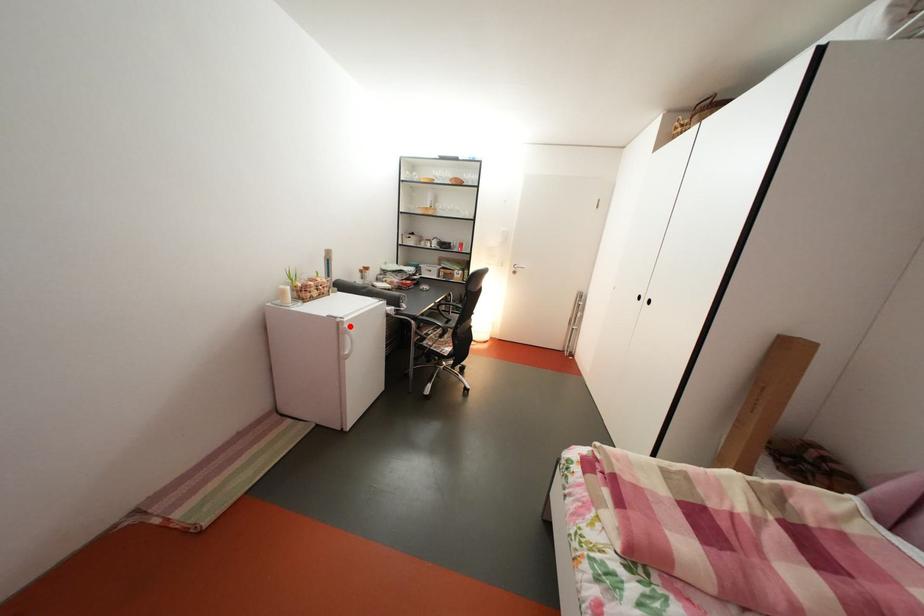
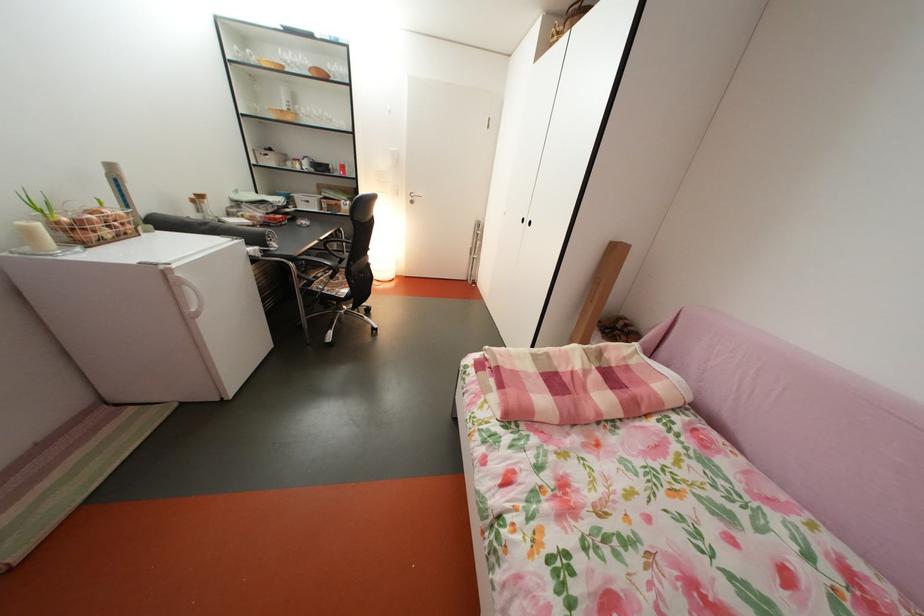
The point at the highlighted location is marked in the first image. Where is the corresponding point in the second image?

(174, 274)